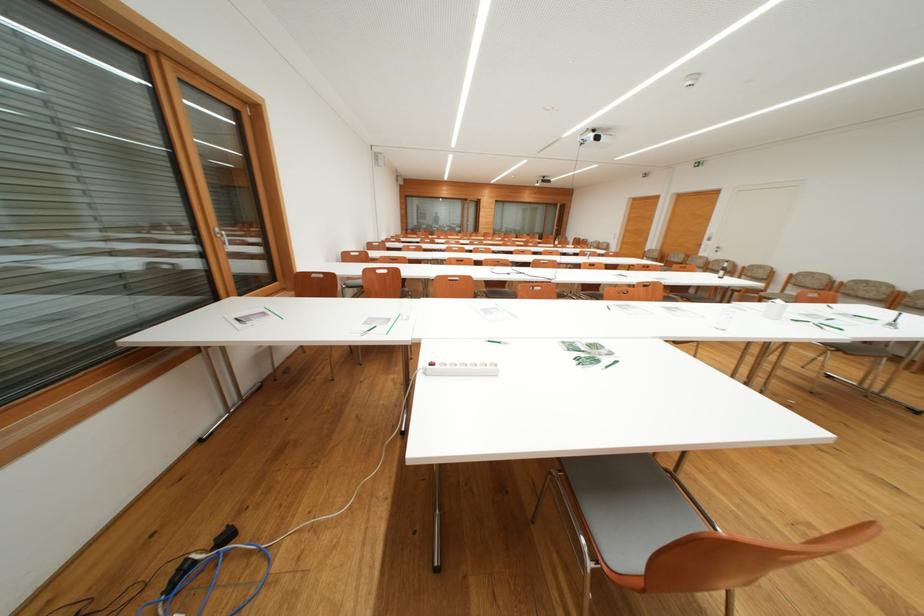
This screenshot has width=924, height=616. What are the coordinates of `red power strip switch` in the screenshot? It's located at (698, 163).